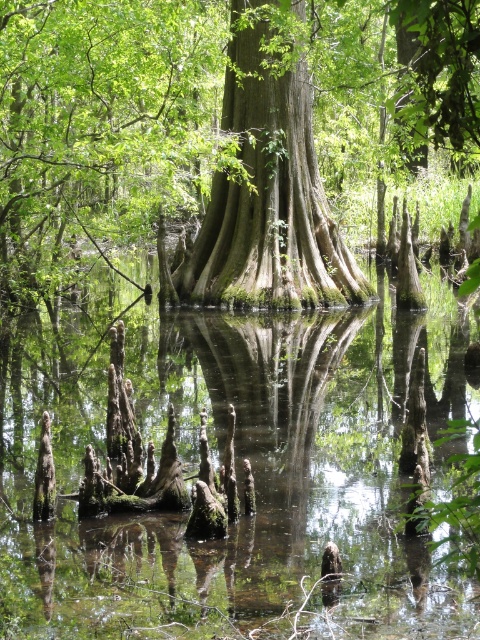
You are navigating a small boat through the swamp and need to avoid the green rough bark tree at center. What are the coordinates of the tree to ensure safe passage?

The green rough bark tree at center is located at coordinates point (226, 131), so you should steer your boat away from that point to avoid collision.

You are a nature photographer trying to capture the swamp scene. You notice the green rough bark tree at center and the green mossy tree trunk at center. Which one is positioned lower in the image?

The green rough bark tree at center is positioned below the green mossy tree trunk at center, so it is lower in the image.

You are standing on the edge of the swamp and need to cross to the other side. You see the green mossy water at center and the green mossy tree trunk at center. Which path would allow you to walk without getting your feet wet?

The green mossy tree trunk at center has a smaller width compared to the green mossy water at center, so walking on the tree trunk might be riskier due to its narrower surface. However, since the tree trunk is above the water, stepping on it would keep your feet dry. The water itself is part of the swamp and would get you wet. Therefore, the green mossy tree trunk at center is the path that keeps your feet dry.